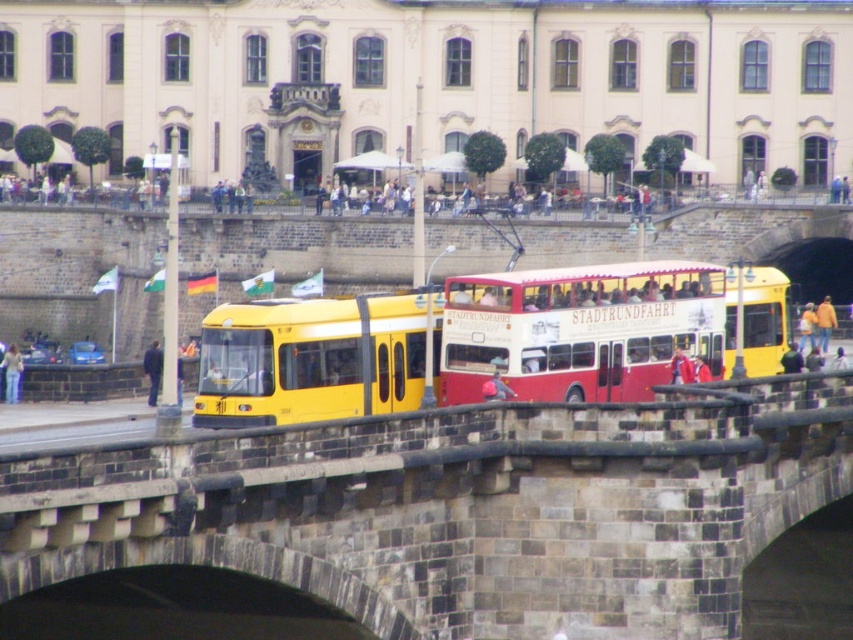
Between stone bridge at center and denim jeans at lower left, which one appears on the left side from the viewer's perspective?

denim jeans at lower left is more to the left.

At what (x,y) coordinates should I click in order to perform the action: click on stone bridge at center. Please return your answer as a coordinate pair (x, y). The image size is (853, 640). Looking at the image, I should click on (461, 508).

Is point (585, 506) positioned before point (833, 317)?

Yes, it is.

Does stone bridge at center appear on the right side of yellow matte bus at center?

Incorrect, stone bridge at center is not on the right side of yellow matte bus at center.

Who is more distant from viewer, (460, 502) or (820, 336)?

Point (820, 336)

This screenshot has height=640, width=853. In order to click on stone bridge at center in this screenshot , I will do `click(461, 508)`.

Who is more forward, (299, 369) or (485, 381)?

Point (299, 369) is more forward.

Is yellow matte tram at center to the left of matte red jacket at center from the viewer's perspective?

Indeed, yellow matte tram at center is positioned on the left side of matte red jacket at center.

Image resolution: width=853 pixels, height=640 pixels. In order to click on yellow matte tram at center in this screenshot , I will do `click(312, 358)`.

Where is `yellow matte tram at center`? The height and width of the screenshot is (640, 853). yellow matte tram at center is located at coordinates (312, 358).